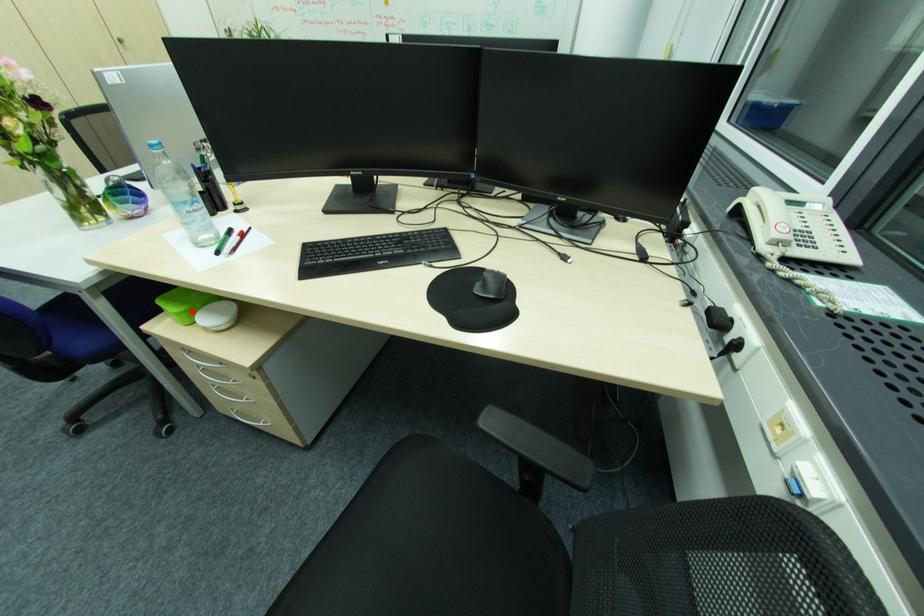
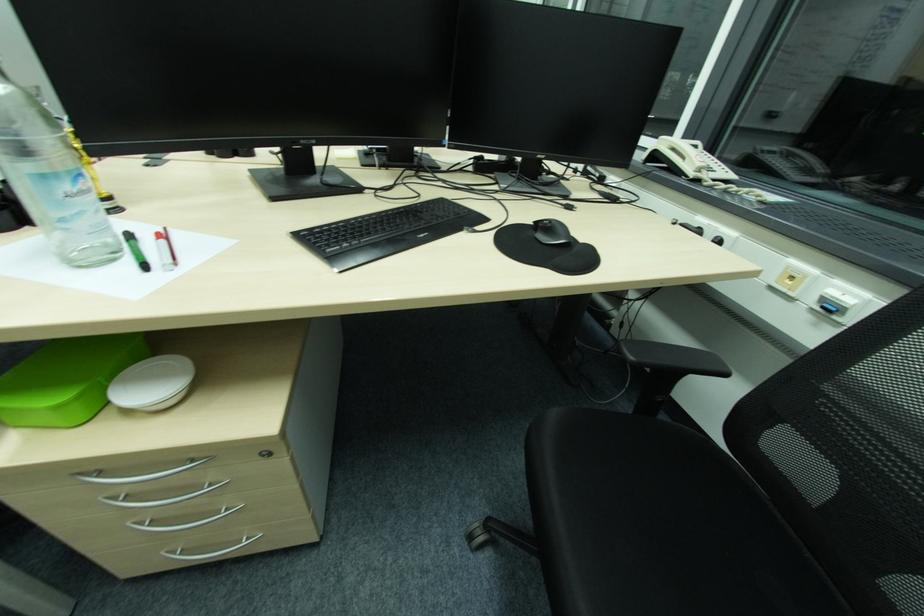
Find the pixel in the second image that matches the highlighted location in the first image.

(84, 395)